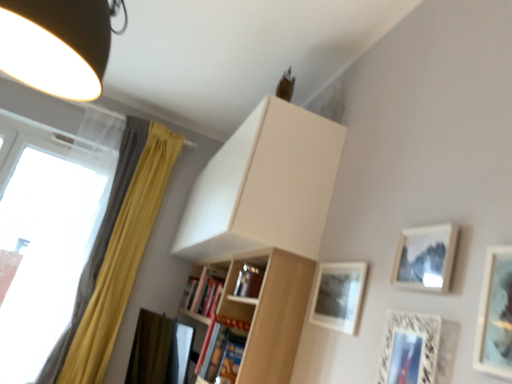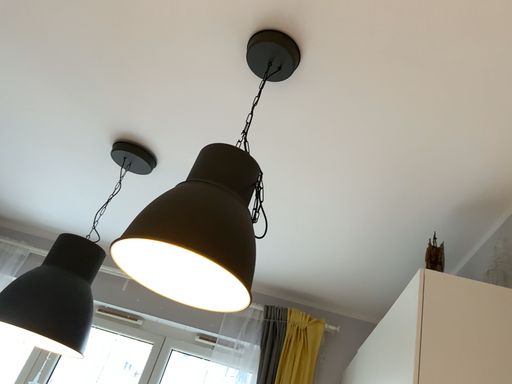
Question: Which way did the camera rotate in the video?

Choices:
 (A) rotated left
 (B) rotated right

Answer: (A)